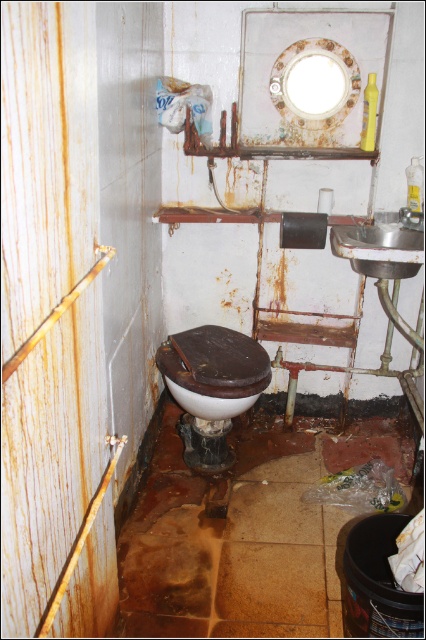
You are a home inspector assessing this bathroom. You need to determine if the white glossy toilet bowl at center can be replaced with a new model that is 2 inches wider than the current one. Can the space accommodate the new toilet bowl? Please consider the satin silver sink at right and the existing layout.

The white glossy toilet bowl at center is currently larger than the satin silver sink at right. Since the new toilet bowl would be even wider, it may not fit in the existing space without adjusting the position of the satin silver sink at right or other fixtures.